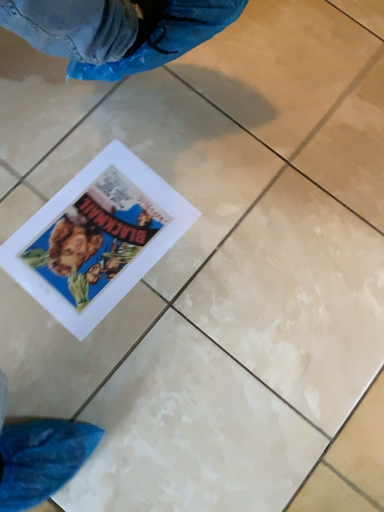
Image resolution: width=384 pixels, height=512 pixels. Identify the location of blue matte poster at center. (96, 238).

What do you see at coordinates (96, 238) in the screenshot? I see `blue matte poster at center` at bounding box center [96, 238].

What is the approximate height of blue matte poster at center?

1.08 inches.

I want to click on blue matte poster at center, so click(96, 238).